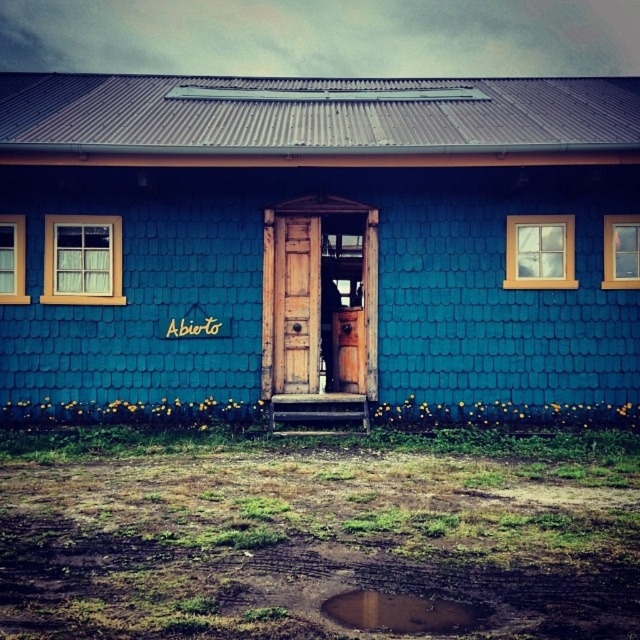
Question: Does wooden door at center have a larger size compared to brown mud puddle at lower center?

Choices:
 (A) no
 (B) yes

Answer: (B)

Question: Which of the following is the closest to the observer?

Choices:
 (A) brown mud puddle at lower center
 (B) wooden door at center

Answer: (A)

Question: Is the position of wooden door at center more distant than that of brown mud puddle at lower center?

Choices:
 (A) yes
 (B) no

Answer: (A)

Question: Does wooden door at center appear over brown mud puddle at lower center?

Choices:
 (A) yes
 (B) no

Answer: (A)